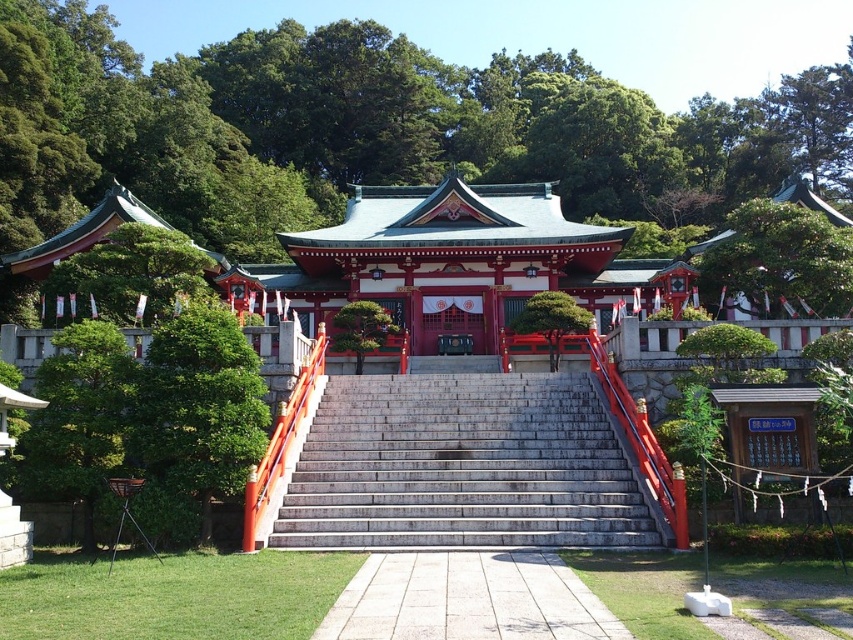
You are standing at the bottom of the staircase leading to the shrine. Looking up, you see the point marked at coordinates (x=198, y=408). What object is located at this point?

The point at coordinates (x=198, y=408) corresponds to the green leafy tree at center.

You are a visitor at the shrine and want to take a photo of the shrine building. You have to choose between standing at the base of the gray stone stairs at center or next to the green leafy tree at left. Which location would give you a better view of the shrine building?

The gray stone stairs at center is much taller than the green leafy tree at left, so standing at the base of the gray stone stairs at center would provide a better view of the shrine building since it is elevated higher than the tree.

You are planning to place a decorative lantern between the gray stone stairs at center and the green leafy tree at center. Which side of the staircase should you place it so it doesn not block the path?

The gray stone stairs at center might be wider than green leafy tree at center, so placing the lantern on the side of the stairs closer to the tree would ensure it doesn not block the path.